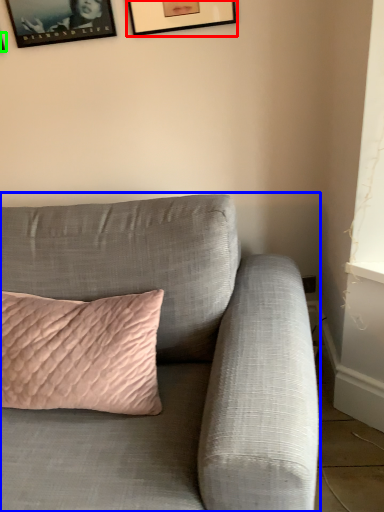
Question: Based on their relative distances, which object is farther from picture frame (highlighted by a red box)? Choose from studio couch (highlighted by a blue box) and picture frame (highlighted by a green box).

Choices:
 (A) studio couch
 (B) picture frame

Answer: (A)